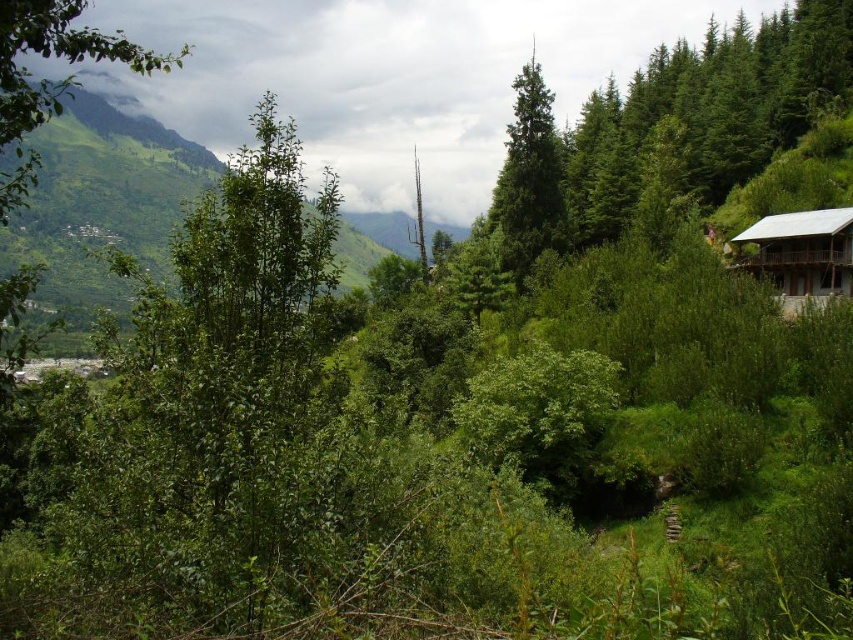
Can you confirm if green matte tree at right is positioned above green matte tree at center?

Incorrect, green matte tree at right is not positioned above green matte tree at center.

Is green matte tree at right positioned at the back of green matte tree at center?

No, green matte tree at right is in front of green matte tree at center.

Who is more distant from viewer, (723, 51) or (527, 262)?

The point (723, 51) is behind.

You are a GUI agent. You are given a task and a screenshot of the screen. Output one action in this format:
    pyautogui.click(x=<x>, y=<y>)
    Task: Click on the green matte tree at right
    This screenshot has height=640, width=853.
    Given the screenshot: What is the action you would take?
    pyautogui.click(x=677, y=118)

Does green matte tree at center have a greater width compared to white wooden cabin at right?

Indeed, green matte tree at center has a greater width compared to white wooden cabin at right.

What do you see at coordinates (529, 179) in the screenshot? This screenshot has height=640, width=853. I see `green matte tree at center` at bounding box center [529, 179].

Is point (547, 243) behind point (791, 253)?

Yes, it is.

You are a GUI agent. You are given a task and a screenshot of the screen. Output one action in this format:
    pyautogui.click(x=<x>, y=<y>)
    Task: Click on the green matte tree at center
    This screenshot has height=640, width=853.
    Given the screenshot: What is the action you would take?
    pyautogui.click(x=529, y=179)

Does green matte tree at right have a greater width compared to white wooden cabin at right?

Indeed, green matte tree at right has a greater width compared to white wooden cabin at right.

Is point (490, 221) positioned before point (822, 253)?

No, it is behind (822, 253).

Locate an element on the screen. Image resolution: width=853 pixels, height=640 pixels. green matte tree at right is located at coordinates (677, 118).